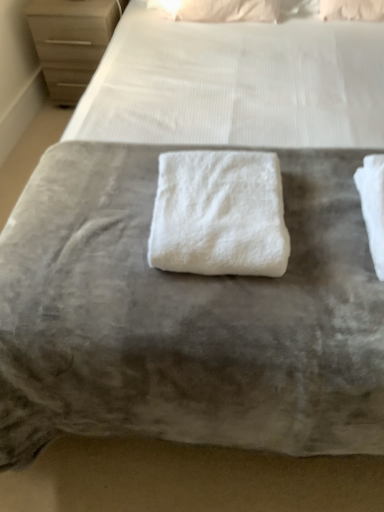
Question: Is matte wood chest of drawers at upper left facing away from white fluffy towel at center?

Choices:
 (A) yes
 (B) no

Answer: (B)

Question: Can you confirm if matte wood chest of drawers at upper left is smaller than white fluffy towel at center?

Choices:
 (A) yes
 (B) no

Answer: (B)

Question: From a real-world perspective, is matte wood chest of drawers at upper left beneath white fluffy towel at center?

Choices:
 (A) yes
 (B) no

Answer: (A)

Question: From a real-world perspective, is matte wood chest of drawers at upper left physically above white fluffy towel at center?

Choices:
 (A) yes
 (B) no

Answer: (B)

Question: Can you confirm if matte wood chest of drawers at upper left is taller than white fluffy towel at center?

Choices:
 (A) yes
 (B) no

Answer: (A)

Question: Is point (41, 56) closer or farther from the camera than point (188, 10)?

Choices:
 (A) closer
 (B) farther

Answer: (B)

Question: In terms of height, does matte wood chest of drawers at upper left look taller or shorter compared to white soft pillow at upper center?

Choices:
 (A) tall
 (B) short

Answer: (A)

Question: From the image's perspective, is matte wood chest of drawers at upper left positioned above or below white soft pillow at upper center?

Choices:
 (A) above
 (B) below

Answer: (B)

Question: Would you say matte wood chest of drawers at upper left is to the left or to the right of white soft pillow at upper center in the picture?

Choices:
 (A) right
 (B) left

Answer: (B)

Question: Considering their positions, is white fluffy towel at center located in front of or behind white soft pillow at upper center?

Choices:
 (A) behind
 (B) front

Answer: (B)

Question: Which is correct: white fluffy towel at center is inside white soft pillow at upper center, or outside of it?

Choices:
 (A) inside
 (B) outside

Answer: (B)

Question: Is point (168, 233) positioned closer to the camera than point (223, 10)?

Choices:
 (A) farther
 (B) closer

Answer: (B)

Question: From a real-world perspective, is white fluffy towel at center physically located above or below white soft pillow at upper center?

Choices:
 (A) below
 (B) above

Answer: (B)

Question: From their relative heights in the image, would you say white fluffy towel at center is taller or shorter than matte wood chest of drawers at upper left?

Choices:
 (A) short
 (B) tall

Answer: (A)

Question: Considering the positions of white fluffy towel at center and matte wood chest of drawers at upper left in the image, is white fluffy towel at center wider or thinner than matte wood chest of drawers at upper left?

Choices:
 (A) wide
 (B) thin

Answer: (B)